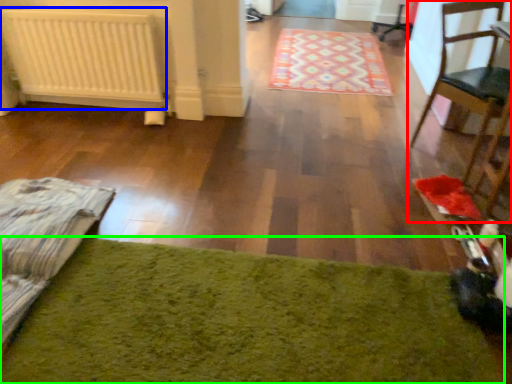
Question: Which is nearer to the chair (highlighted by a red box)? radiator (highlighted by a blue box) or mat (highlighted by a green box).

Choices:
 (A) radiator
 (B) mat

Answer: (B)